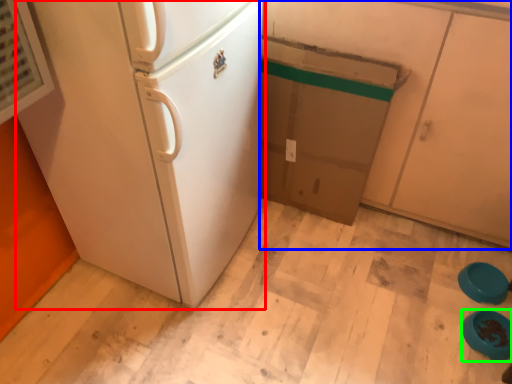
Question: Based on their relative distances, which object is farther from refrigerator (highlighted by a red box)? Choose from cabinetry (highlighted by a blue box) and appliance (highlighted by a green box).

Choices:
 (A) cabinetry
 (B) appliance

Answer: (B)